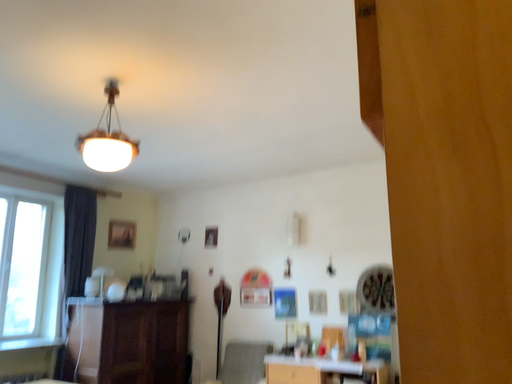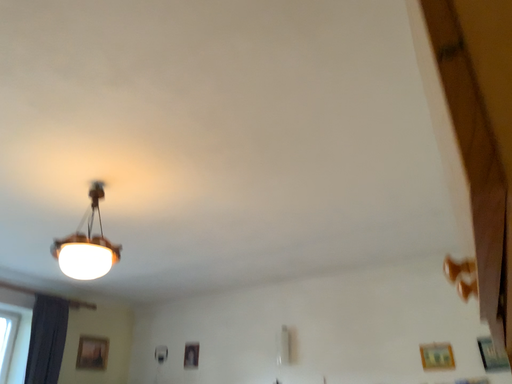
Question: Which way did the camera rotate in the video?

Choices:
 (A) rotated downward
 (B) rotated upward

Answer: (B)